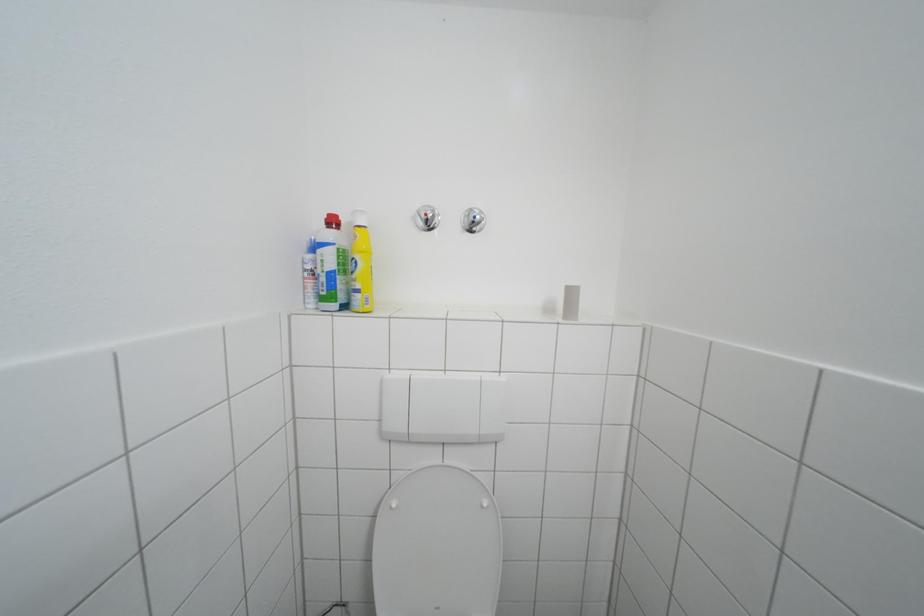
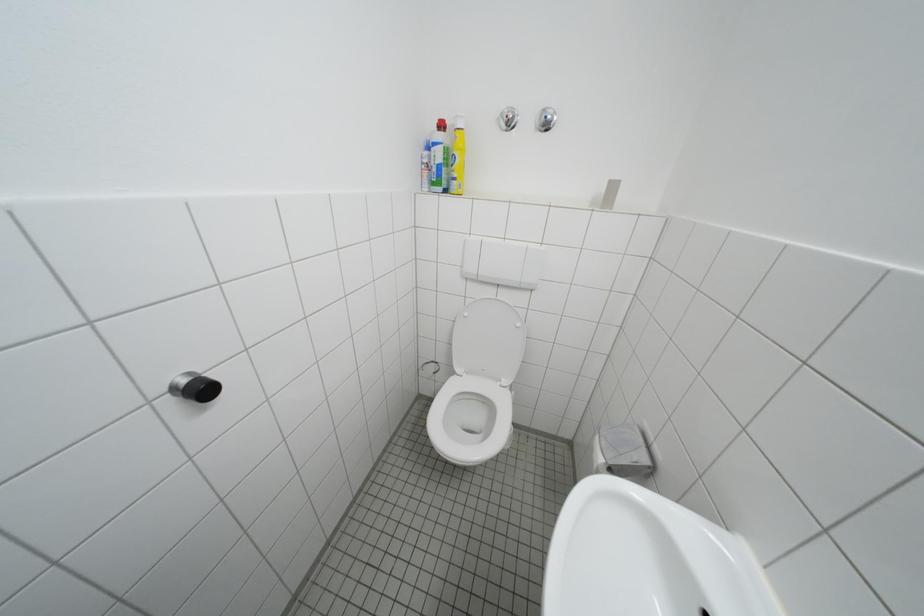
The first image is from the beginning of the video and the second image is from the end. How did the camera likely rotate when shooting the video?

The camera rotated toward left-down.